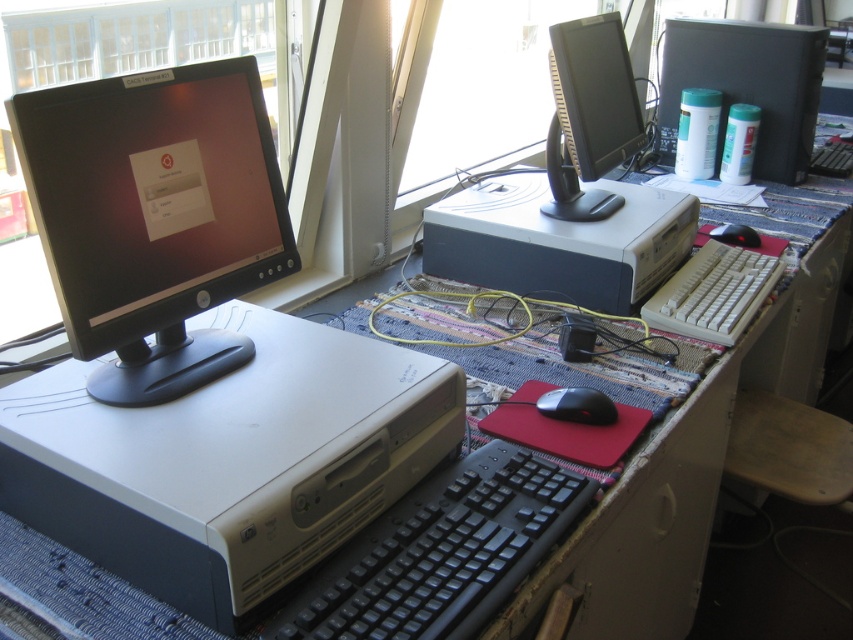
Question: Can you confirm if matte black monitor at upper right is smaller than black plastic mouse at lower center?

Choices:
 (A) yes
 (B) no

Answer: (B)

Question: Considering the relative positions of black plastic mouse at lower center and black rubber mouse at center in the image provided, where is black plastic mouse at lower center located with respect to black rubber mouse at center?

Choices:
 (A) left
 (B) right

Answer: (A)

Question: Does gray matte desktop computer at center have a smaller size compared to white plastic computer at upper right?

Choices:
 (A) no
 (B) yes

Answer: (A)

Question: Estimate the real-world distances between objects in this image. Which object is farther from the black glossy monitor at left?

Choices:
 (A) black plastic keyboard at center
 (B) gray matte desktop computer at center
 (C) matte black monitor at upper right

Answer: (C)

Question: Which of these objects is positioned closest to the white plastic keyboard at right?

Choices:
 (A) white plastic computer at upper right
 (B) matte black monitor at upper right
 (C) black plastic keyboard at center

Answer: (B)

Question: Which point is closer to the camera?

Choices:
 (A) (729, 234)
 (B) (728, 298)
 (C) (775, 116)
 (D) (140, 122)

Answer: (D)